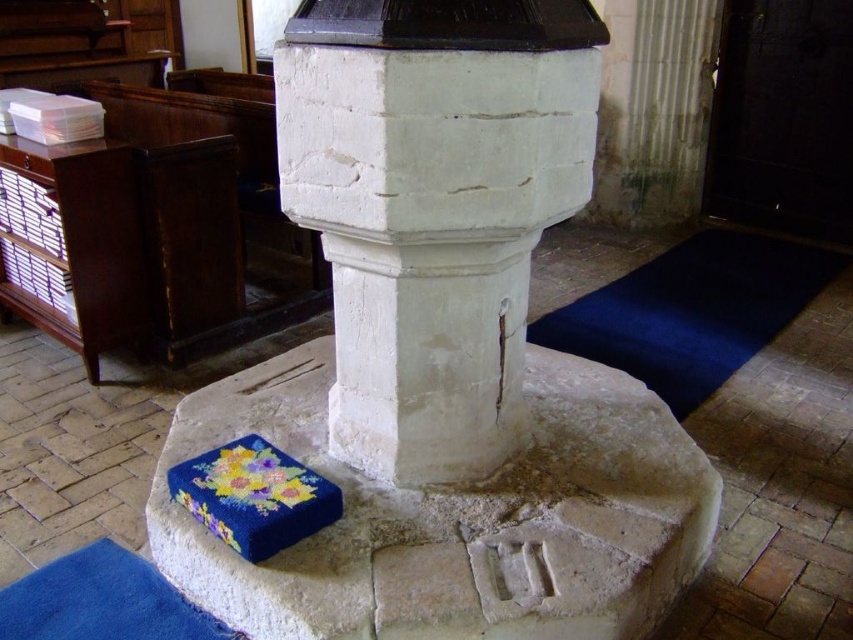
Question: Can you confirm if white stone pillar at center is positioned below dark blue carpet at lower right?

Choices:
 (A) no
 (B) yes

Answer: (A)

Question: Which point is closer to the camera taking this photo?

Choices:
 (A) (625, 538)
 (B) (805, 244)
 (C) (450, 298)
 (D) (120, 636)

Answer: (A)

Question: Considering the relative positions of dark blue carpet at lower right and blue felt mat at lower left in the image provided, where is dark blue carpet at lower right located with respect to blue felt mat at lower left?

Choices:
 (A) right
 (B) left

Answer: (A)

Question: Which point is closer to the camera?

Choices:
 (A) (175, 518)
 (B) (86, 570)
 (C) (763, 260)
 (D) (505, 154)

Answer: (D)

Question: Can you confirm if blue felt box at lower left is positioned to the right of blue felt mat at lower left?

Choices:
 (A) no
 (B) yes

Answer: (B)

Question: Which is nearer to the blue felt mat at lower left?

Choices:
 (A) white stone pillar at center
 (B) blue felt box at lower left

Answer: (B)